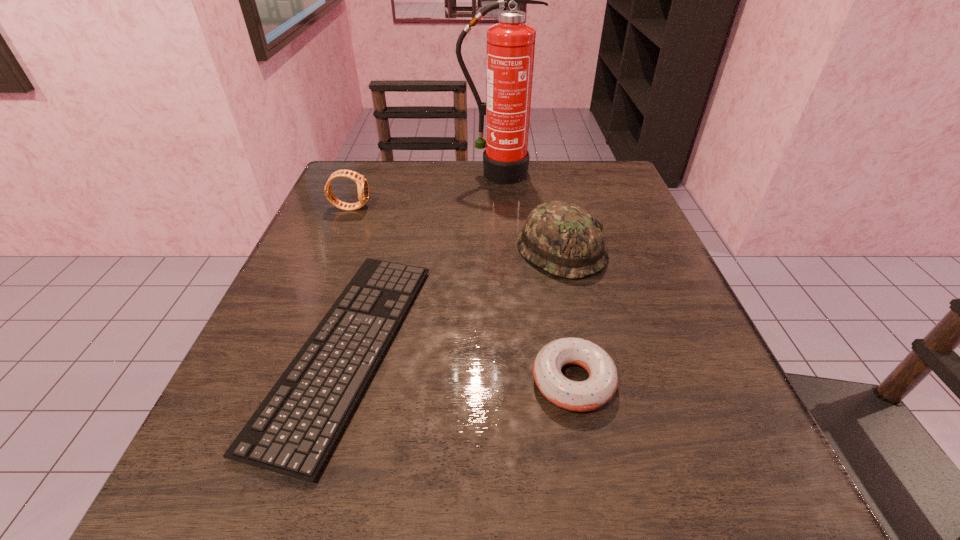
In the image, there is a desktop. In order to click on free space at the far edge in this screenshot , I will do `click(556, 188)`.

Find the location of `vacant space at the near edge`. vacant space at the near edge is located at coordinates (564, 475).

Find the location of `vacant space at the left edge of the desktop`. vacant space at the left edge of the desktop is located at coordinates (312, 269).

Locate an element on the screen. vacant space at the right edge of the desktop is located at coordinates (628, 223).

The width and height of the screenshot is (960, 540). In order to click on vacant space at the far left corner in this screenshot , I will do `click(401, 178)`.

Locate an element on the screen. vacant space at the near left corner of the desktop is located at coordinates (263, 477).

Locate an element on the screen. The width and height of the screenshot is (960, 540). free space at the far right corner is located at coordinates (589, 194).

This screenshot has width=960, height=540. I want to click on free space at the near right corner, so click(x=671, y=488).

The height and width of the screenshot is (540, 960). I want to click on vacant space that's between the headwear and the second farthest object, so click(456, 229).

Identify the location of unoccupied position between the fourth tallest object and the fire extinguisher. (535, 278).